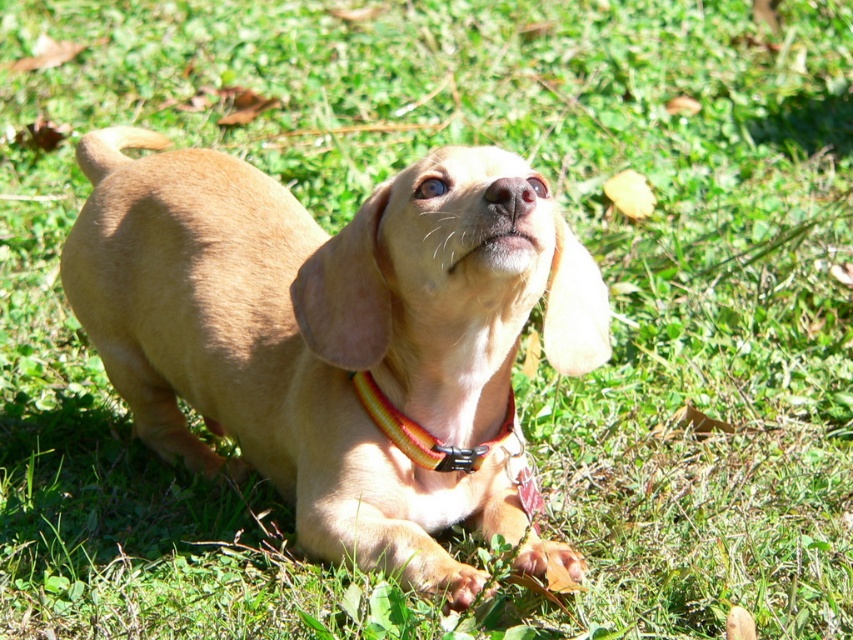
You are a photographer standing at a certain distance from the light brown fur at center. You want to take a closeup shot of the fur. Is the current distance sufficient for a clear closeup?

The light brown fur at center is 1.53 meters from the camera. Whether this distance is sufficient for a clear closeup depends on the camera lens capabilities. Most standard lenses can focus clearly at this distance, so it should be possible to achieve a sharp closeup.

Based on the scene description, where is the light brown fur at center located in terms of coordinates?

The light brown fur at center is located at the coordinates point (x=338, y=337).